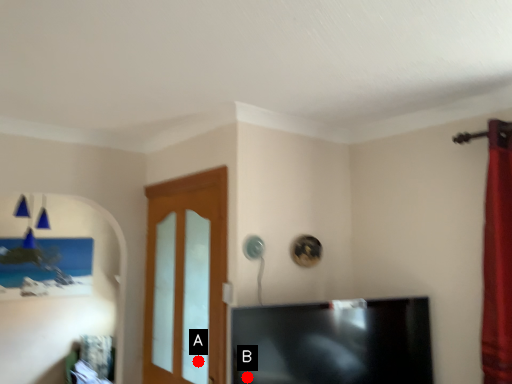
Question: Two points are circled on the image, labeled by A and B beside each circle. Which point appears closest to the camera in this image?

Choices:
 (A) A is closer
 (B) B is closer

Answer: (B)